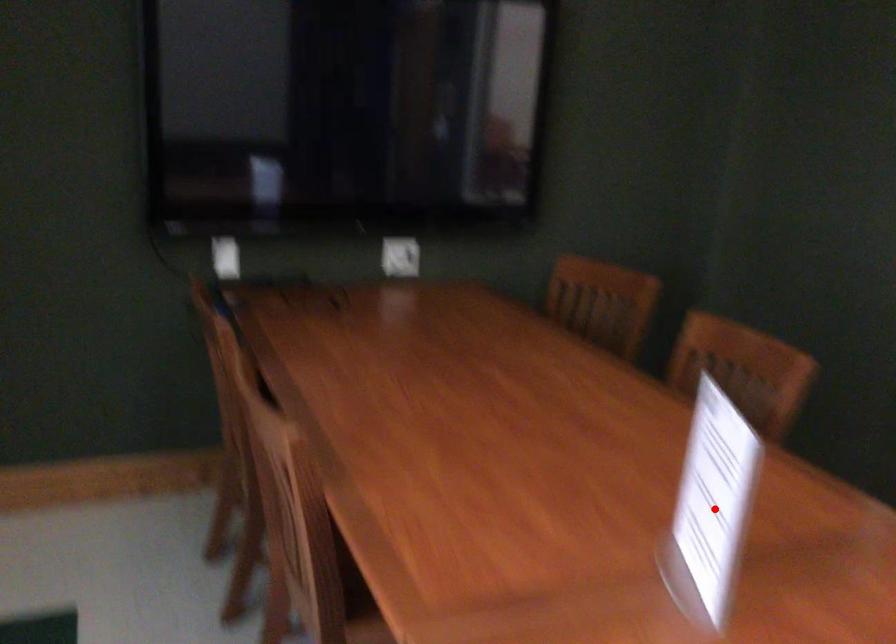
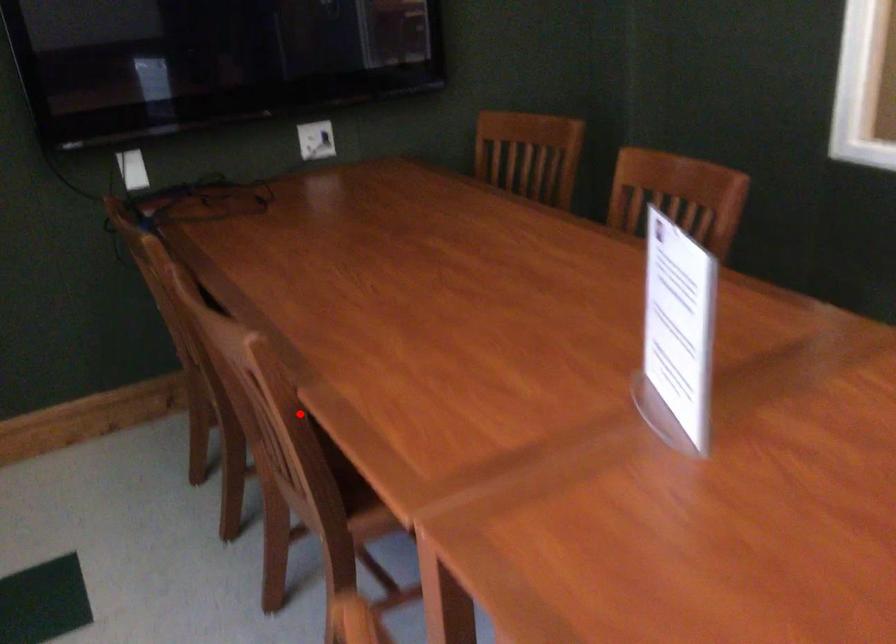
I am providing you with two images of the same scene from different viewpoints. A red point is marked on the first image and another point is marked on the second image. Is the marked point in image1 the same physical position as the marked point in image2?

No